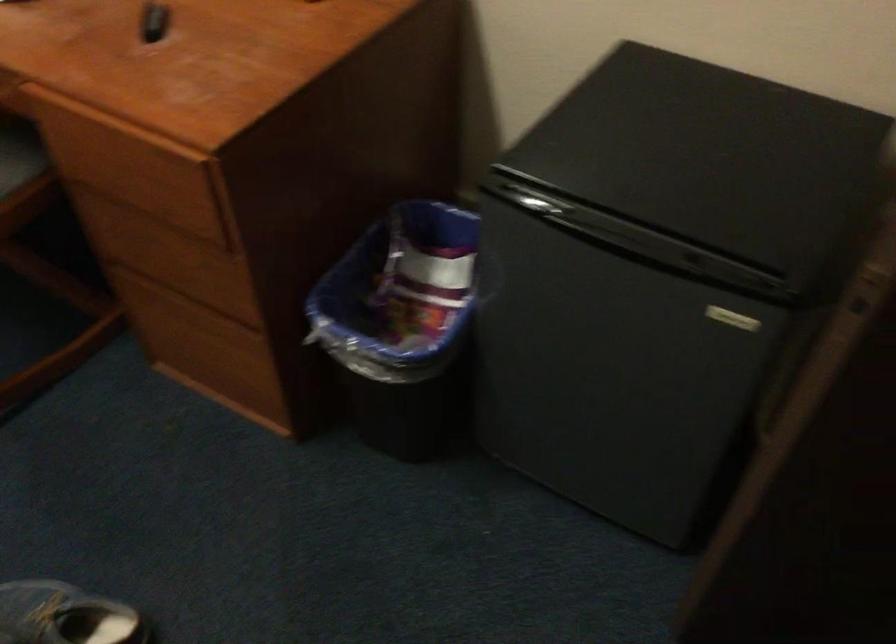
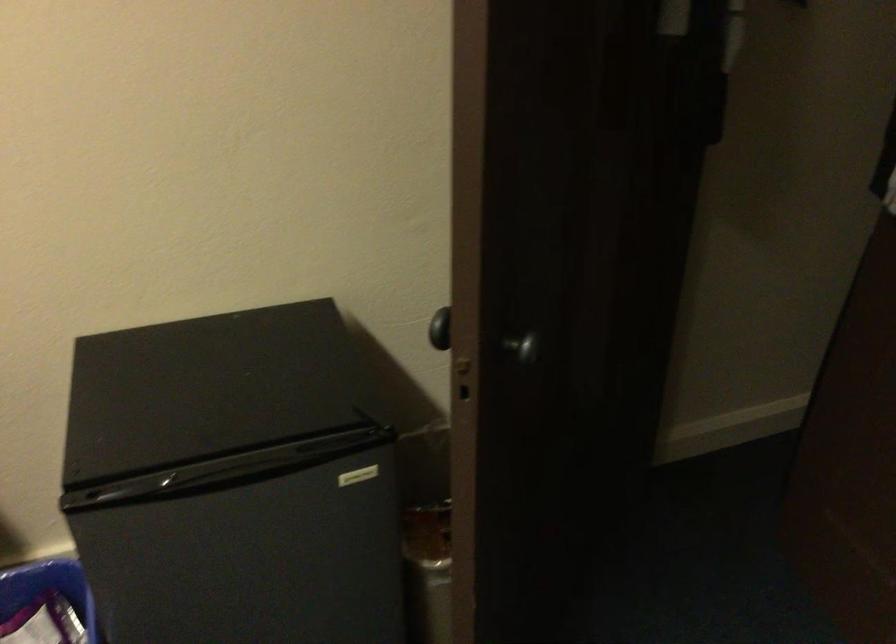
Question: Based on the continuous images, in which direction is the camera rotating? Reply with the corresponding letter.

Choices:
 (A) Left
 (B) Right
 (C) Up
 (D) Down

Answer: (B)